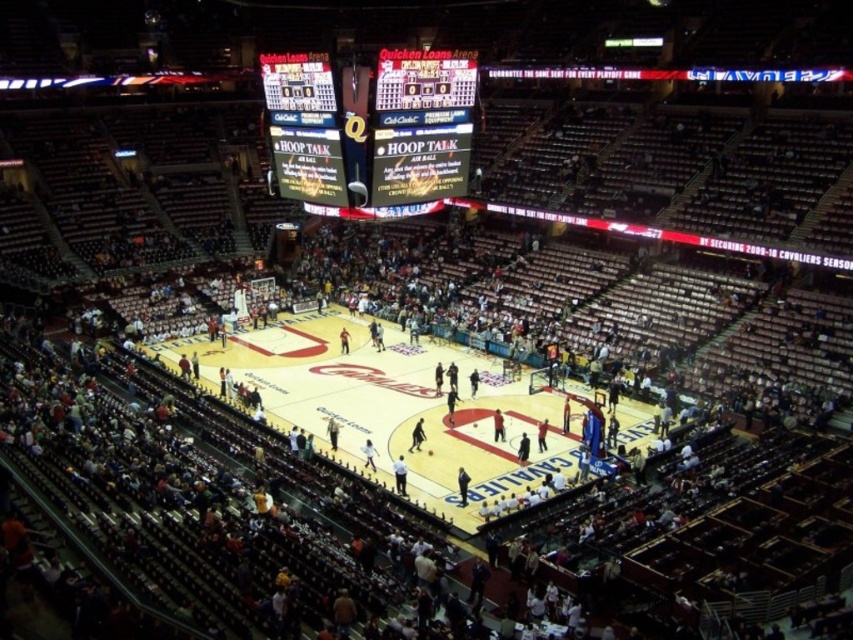
You are a drone operator trying to capture aerial footage of the basketball court. The drone is currently hovering at the center of the arena. To ensure the black glossy scoreboard at upper center is visible in the shot, in which direction should you tilt the camera? Please answer with the direction as a cardinal direction like North, South, East, or West.

The black glossy scoreboard at upper center is located at point (372, 129). Since the drone is at the center of the arena, tilting the camera North would align it with the scoreboard.

In the scene shown: You are a spectator at the game and want to take a photo of both the black glossy scoreboard at upper center and the matte black scoreboard at upper center. Which one is on the left side when facing the court?

The black glossy scoreboard at upper center is positioned on the left side of the matte black scoreboard at upper center, so when facing the court, the black glossy scoreboard at upper center is on the left.